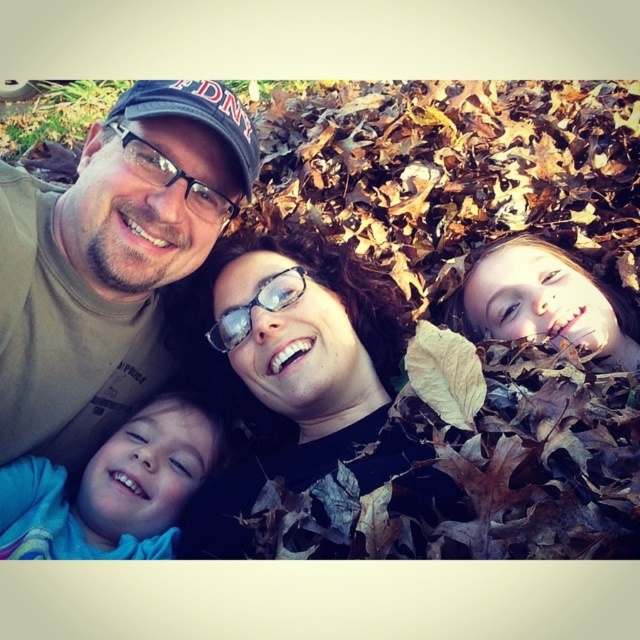
Between matte khaki shirt at upper left and blue soft fabric at lower left, which one has more height?

matte khaki shirt at upper left

How much distance is there between matte khaki shirt at upper left and blue soft fabric at lower left?

matte khaki shirt at upper left and blue soft fabric at lower left are 9.80 inches apart.

Describe the element at coordinates (109, 260) in the screenshot. I see `matte khaki shirt at upper left` at that location.

Image resolution: width=640 pixels, height=640 pixels. In order to click on matte khaki shirt at upper left in this screenshot , I will do `click(109, 260)`.

The width and height of the screenshot is (640, 640). What do you see at coordinates (454, 323) in the screenshot?
I see `matte black hair at center` at bounding box center [454, 323].

Which is more to the left, matte black hair at center or blue soft fabric at lower left?

From the viewer's perspective, blue soft fabric at lower left appears more on the left side.

You are a GUI agent. You are given a task and a screenshot of the screen. Output one action in this format:
    pyautogui.click(x=<x>, y=<y>)
    Task: Click on the matte black hair at center
    The width and height of the screenshot is (640, 640).
    Given the screenshot: What is the action you would take?
    pyautogui.click(x=454, y=323)

Locate an element on the screen. The image size is (640, 640). matte black hair at center is located at coordinates click(454, 323).

Between matte black hair at center and black matte glasses at center, which one is positioned higher?

matte black hair at center

Who is more distant from viewer, [390,205] or [195,314]?

The point [390,205] is behind.

You are a GUI agent. You are given a task and a screenshot of the screen. Output one action in this format:
    pyautogui.click(x=<x>, y=<y>)
    Task: Click on the matte black hair at center
    
    Given the screenshot: What is the action you would take?
    pyautogui.click(x=454, y=323)